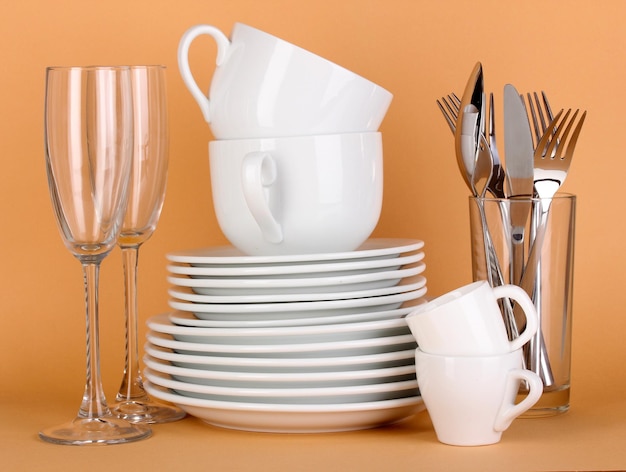
You are a GUI agent. You are given a task and a screenshot of the screen. Output one action in this format:
    pyautogui.click(x=<x>, y=<y>)
    Task: Click on the drinking cups and glasses
    The height and width of the screenshot is (472, 626).
    Given the screenshot: What is the action you would take?
    pyautogui.click(x=567, y=254), pyautogui.click(x=475, y=310), pyautogui.click(x=467, y=385), pyautogui.click(x=332, y=201), pyautogui.click(x=327, y=107), pyautogui.click(x=155, y=155), pyautogui.click(x=78, y=166)